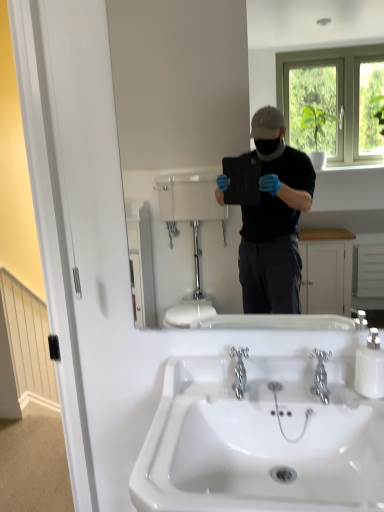
Question: Is matte black tablet at center inside the boundaries of white glossy soap dispenser at right, or outside?

Choices:
 (A) outside
 (B) inside

Answer: (A)

Question: From their relative heights in the image, would you say matte black tablet at center is taller or shorter than white glossy soap dispenser at right?

Choices:
 (A) tall
 (B) short

Answer: (A)

Question: Which of these objects is positioned farthest from the white glossy sink at center?

Choices:
 (A) chrome metallic faucet at center, which is the first plumbing fixture from left to right
 (B) matte black tablet at center
 (C) white glossy soap dispenser at right
 (D) polished chrome faucet at center, which is counted as the 2th plumbing fixture, starting from the left

Answer: (B)

Question: Which object is the closest to the white glossy sink at center?

Choices:
 (A) chrome metallic faucet at center, which is the first plumbing fixture from left to right
 (B) white glossy soap dispenser at right
 (C) polished chrome faucet at center, which is counted as the 2th plumbing fixture, starting from the left
 (D) matte black tablet at center

Answer: (A)